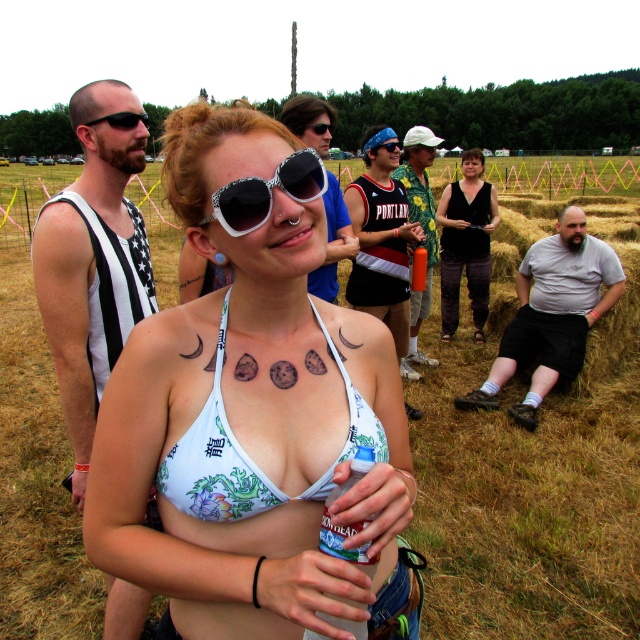
You are a photographer at the festival and want to capture both the orange matte water bottle at center and the white plastic goggles at center in a single shot. Since you want to focus on the goggles, which object should you adjust your camera to prioritize in terms of size?

The orange matte water bottle at center is wider than the white plastic goggles at center, so you should adjust your camera to prioritize focusing on the white plastic goggles at center to ensure they are clearly visible in the photo.

You are a photographer at the festival, and you need to capture both the white floral bikini top at center and the black jersey at center in the same frame. Based on their sizes, which one will appear smaller in the photo?

The white floral bikini top at center is not as tall as the black jersey at center, so it will appear smaller in the photo.